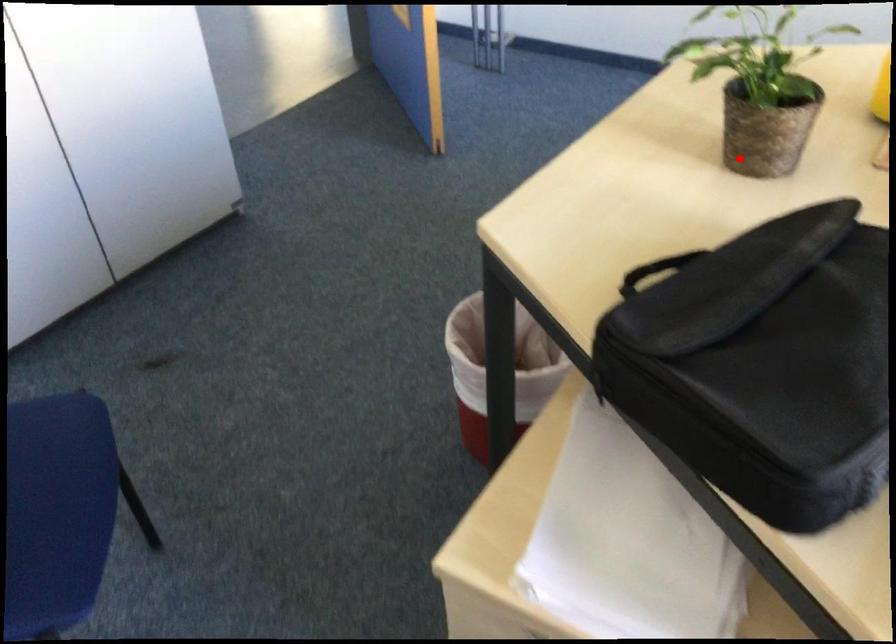
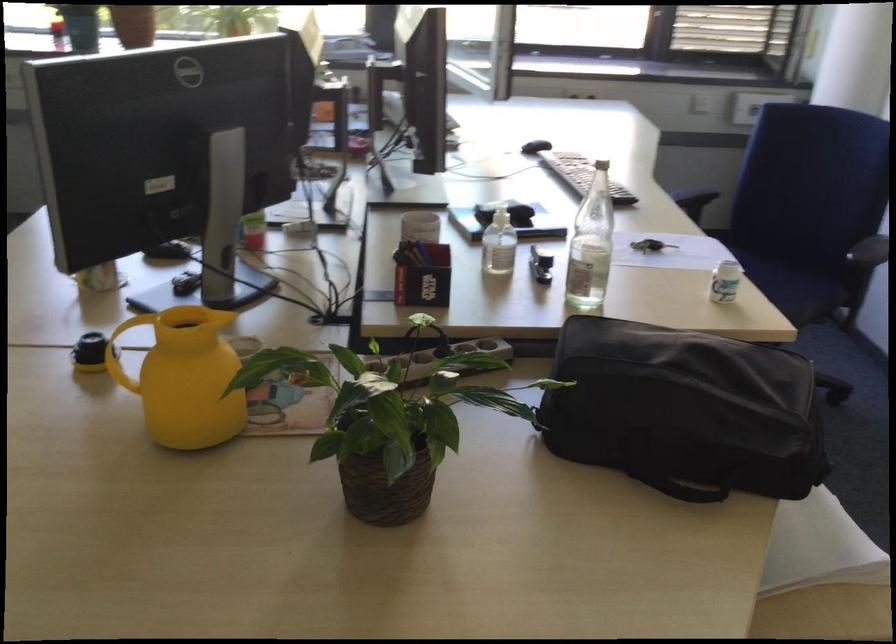
In the second image, find the point that corresponds to the highlighted location in the first image.

(383, 484)